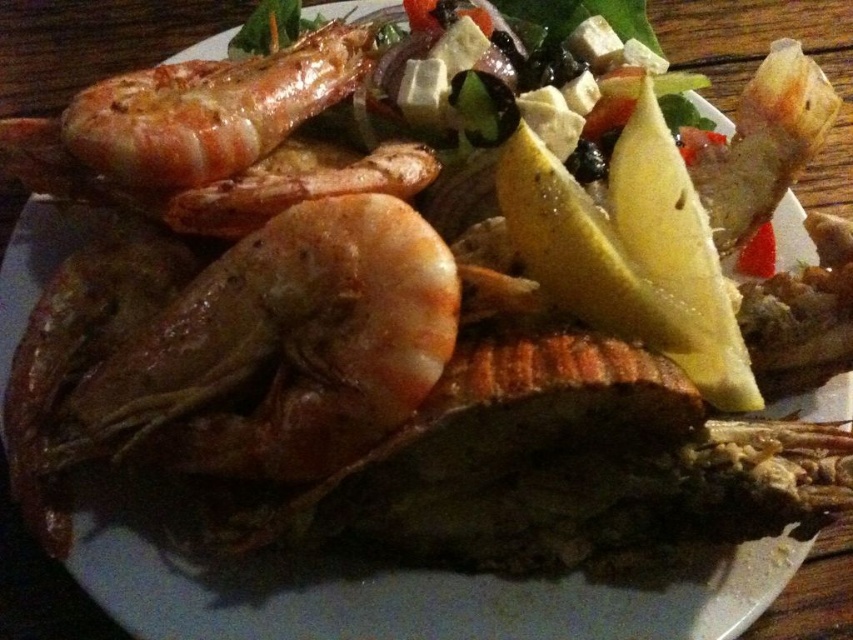
The height and width of the screenshot is (640, 853). What do you see at coordinates (282, 348) in the screenshot?
I see `shiny brown shrimp at center` at bounding box center [282, 348].

Is point (318, 472) closer to viewer compared to point (242, 179)?

Yes.

Find the location of a particular element. This screenshot has width=853, height=640. shiny brown shrimp at center is located at coordinates (282, 348).

Who is shorter, shiny brown shrimp at center or fresh green salad at upper center?

With less height is shiny brown shrimp at center.

Is shiny brown shrimp at center below fresh green salad at upper center?

Correct, shiny brown shrimp at center is located below fresh green salad at upper center.

Between point (312, 358) and point (675, 326), which one is positioned in front?

Point (312, 358)

What are the coordinates of `shiny brown shrimp at center` in the screenshot? It's located at (282, 348).

Which is behind, point (637, 227) or point (167, 202)?

Point (167, 202)

Is fresh green salad at upper center taller than golden brown fried shrimp at center?

Correct, fresh green salad at upper center is much taller as golden brown fried shrimp at center.

Is point (624, 81) positioned in front of point (376, 188)?

No, it is not.

Image resolution: width=853 pixels, height=640 pixels. I want to click on fresh green salad at upper center, so click(653, 212).